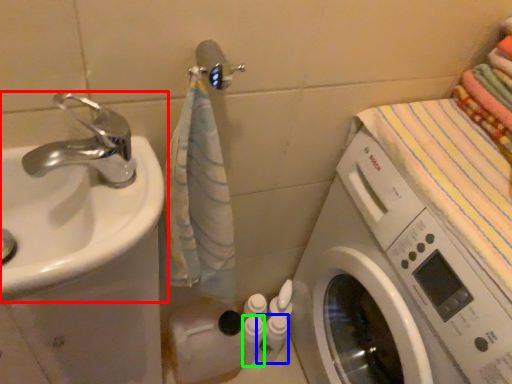
Question: Estimate the real-world distances between objects in this image. Which object is closer to sink (highlighted by a red box), toiletry (highlighted by a blue box) or toiletry (highlighted by a green box)?

Choices:
 (A) toiletry
 (B) toiletry

Answer: (B)